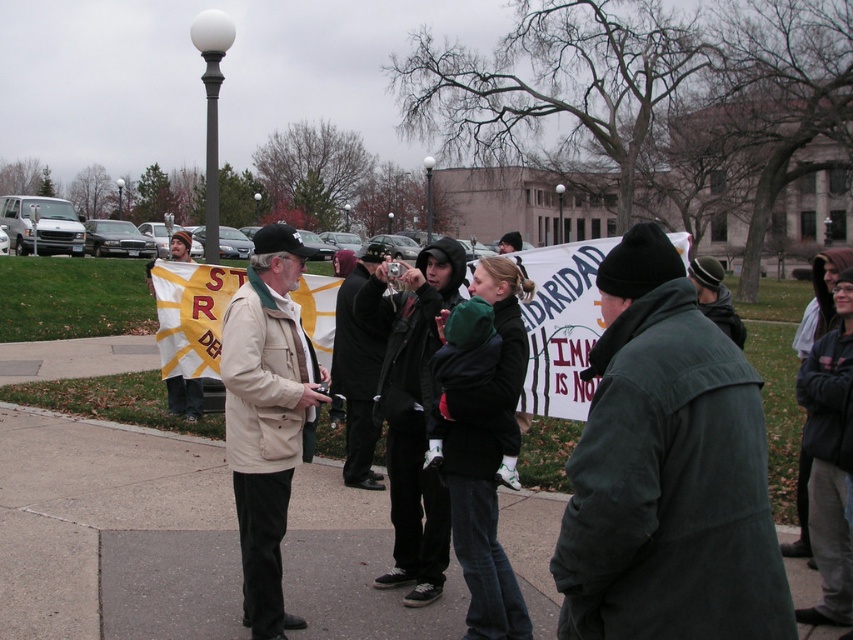
Measure the distance from dark green jacket at center to dark green knit cap at center.

82.54 centimeters

What do you see at coordinates (666, 472) in the screenshot? I see `dark green jacket at center` at bounding box center [666, 472].

The height and width of the screenshot is (640, 853). Find the location of `dark green jacket at center`. dark green jacket at center is located at coordinates (666, 472).

Which is above, dark green knit cap at center or yellow and white striped banner at center?

Positioned higher is dark green knit cap at center.

Which is more to the left, dark green knit cap at center or yellow and white striped banner at center?

Positioned to the left is yellow and white striped banner at center.

Locate an element on the screen. Image resolution: width=853 pixels, height=640 pixels. dark green knit cap at center is located at coordinates (715, 298).

Can you confirm if beige fabric jacket at center is positioned to the left of yellow and white striped banner at center?

No, beige fabric jacket at center is not to the left of yellow and white striped banner at center.

Between beige fabric jacket at center and yellow and white striped banner at center, which one appears on the right side from the viewer's perspective?

beige fabric jacket at center

Between point (223, 358) and point (172, 387), which one is positioned behind?

Point (172, 387)

Locate an element on the screen. This screenshot has width=853, height=640. beige fabric jacket at center is located at coordinates (267, 417).